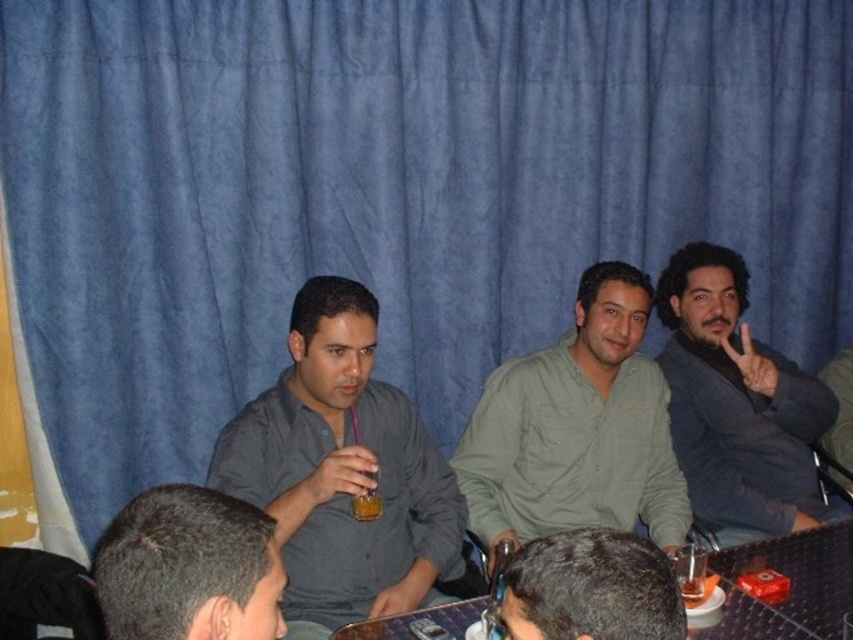
Can you confirm if matte gray shirt at center is positioned below translucent glass at center?

No.

Who is positioned more to the left, matte gray shirt at center or translucent glass at center?

matte gray shirt at center

You are a GUI agent. You are given a task and a screenshot of the screen. Output one action in this format:
    pyautogui.click(x=<x>, y=<y>)
    Task: Click on the matte gray shirt at center
    The width and height of the screenshot is (853, 640).
    Given the screenshot: What is the action you would take?
    pyautogui.click(x=341, y=472)

Locate an element on the screen. The height and width of the screenshot is (640, 853). matte gray shirt at center is located at coordinates (341, 472).

Can you confirm if dark blue suit at right is bigger than dark brown hair at lower center?

Yes.

Is dark blue suit at right to the right of dark brown hair at lower center from the viewer's perspective?

Correct, you'll find dark blue suit at right to the right of dark brown hair at lower center.

What do you see at coordinates (737, 403) in the screenshot? I see `dark blue suit at right` at bounding box center [737, 403].

Identify the location of dark blue suit at right. (737, 403).

Which of these two, dark blue suit at right or translucent glass at center, stands taller?

dark blue suit at right is taller.

Does point (677, 340) come behind point (360, 500)?

That is True.

The height and width of the screenshot is (640, 853). Find the location of `dark blue suit at right`. dark blue suit at right is located at coordinates (737, 403).